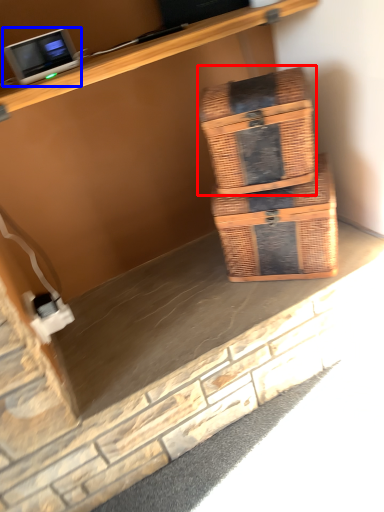
Question: Which object is further to the camera taking this photo, box (highlighted by a red box) or desktop computer (highlighted by a blue box)?

Choices:
 (A) box
 (B) desktop computer

Answer: (A)